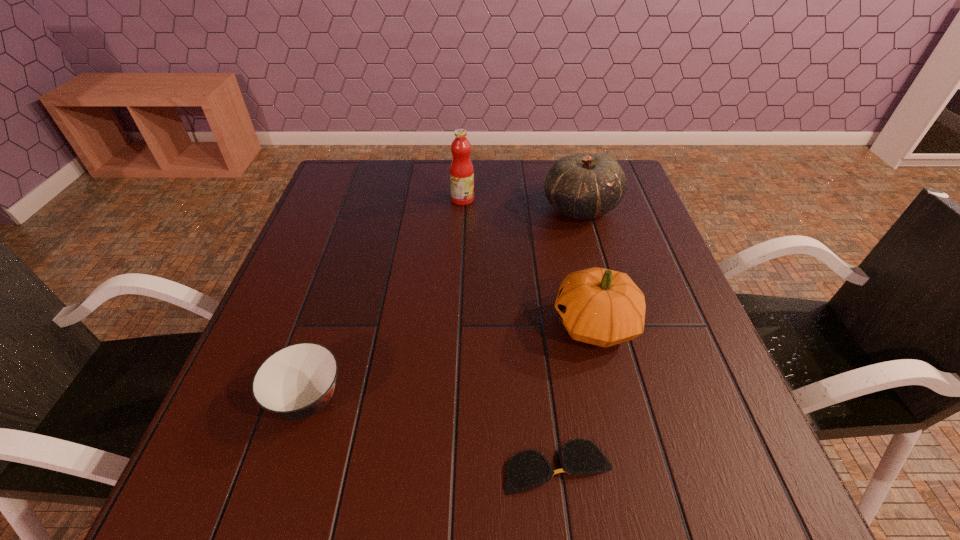
Image resolution: width=960 pixels, height=540 pixels. I want to click on free space at the far edge of the desktop, so click(x=497, y=163).

What are the coordinates of `vacant space at the left edge of the desktop` in the screenshot? It's located at (317, 252).

Where is `free space at the right edge of the desktop`? The width and height of the screenshot is (960, 540). free space at the right edge of the desktop is located at coordinates (662, 328).

Locate an element on the screen. free point at the near left corner is located at coordinates (197, 518).

In the image, there is a desktop. Identify the location of vacant space at the near right corner. Image resolution: width=960 pixels, height=540 pixels. (738, 474).

Where is `free spot between the farther gourd and the fruit juice`? The image size is (960, 540). free spot between the farther gourd and the fruit juice is located at coordinates (522, 204).

Identify the location of unoccupied position between the fourth farthest object and the tallest object. (385, 299).

At what (x,y) coordinates should I click in order to perform the action: click on empty location between the spectacles and the nearer gourd. Please return your answer as a coordinate pair (x, y). Looking at the image, I should click on (577, 395).

The image size is (960, 540). Find the location of `free space between the spectacles and the leftmost object`. free space between the spectacles and the leftmost object is located at coordinates (433, 433).

Identify the location of empty space between the farther gourd and the soup bowl. The width and height of the screenshot is (960, 540). (444, 303).